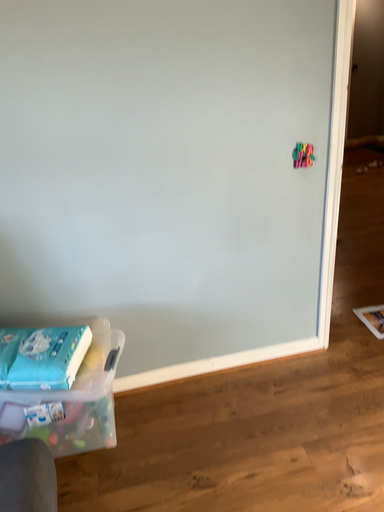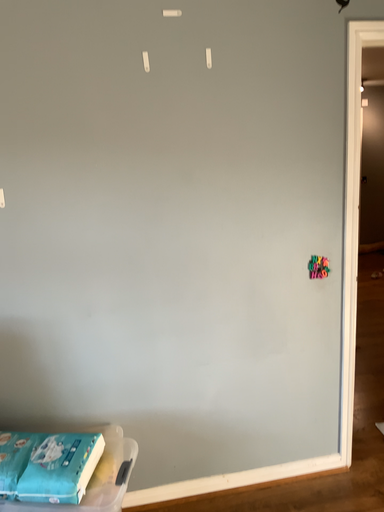
Question: How did the camera likely rotate when shooting the video?

Choices:
 (A) rotated upward
 (B) rotated downward

Answer: (A)